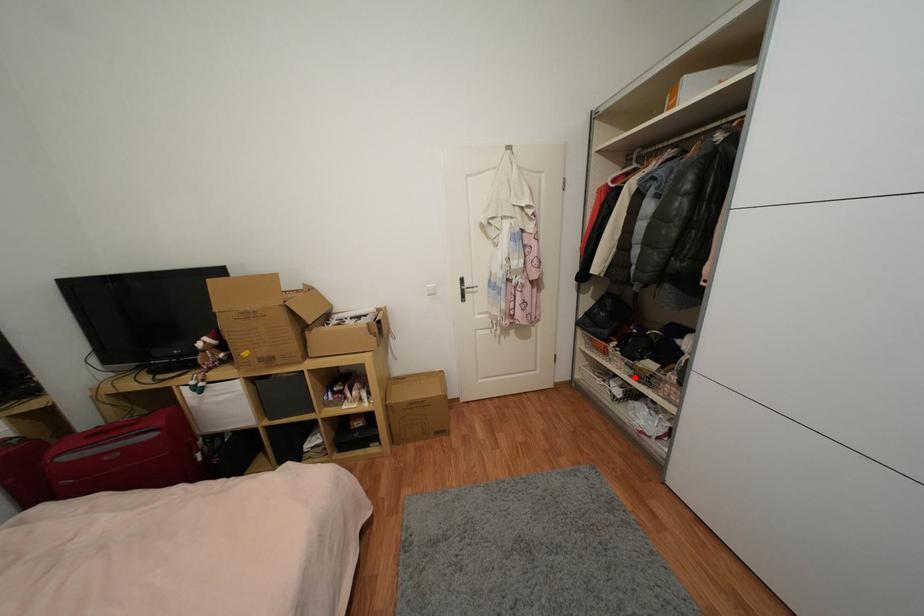
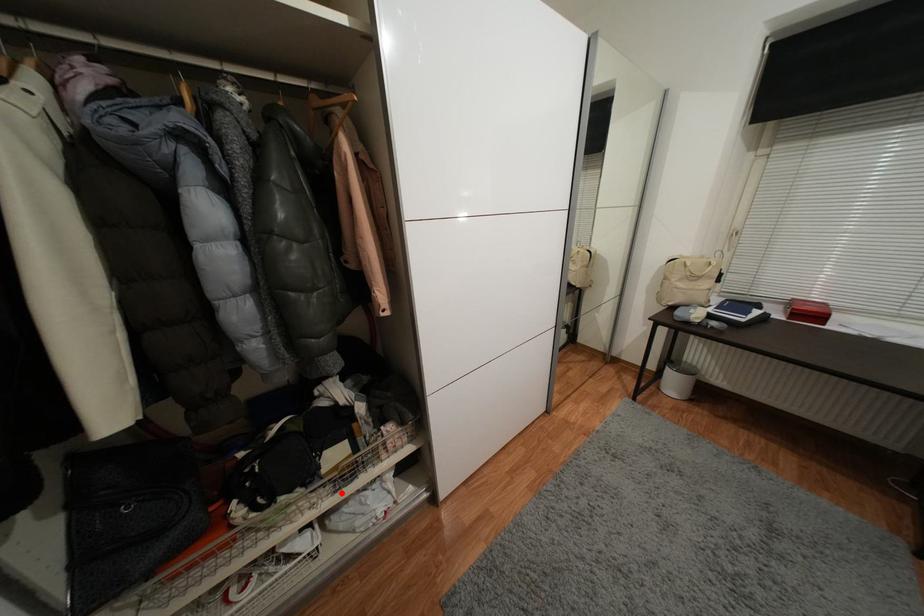
I am providing you with two images of the same scene from different viewpoints. A red point is marked on the first image and another point is marked on the second image. Do the highlighted points in image1 and image2 indicate the same real-world spot?

Yes